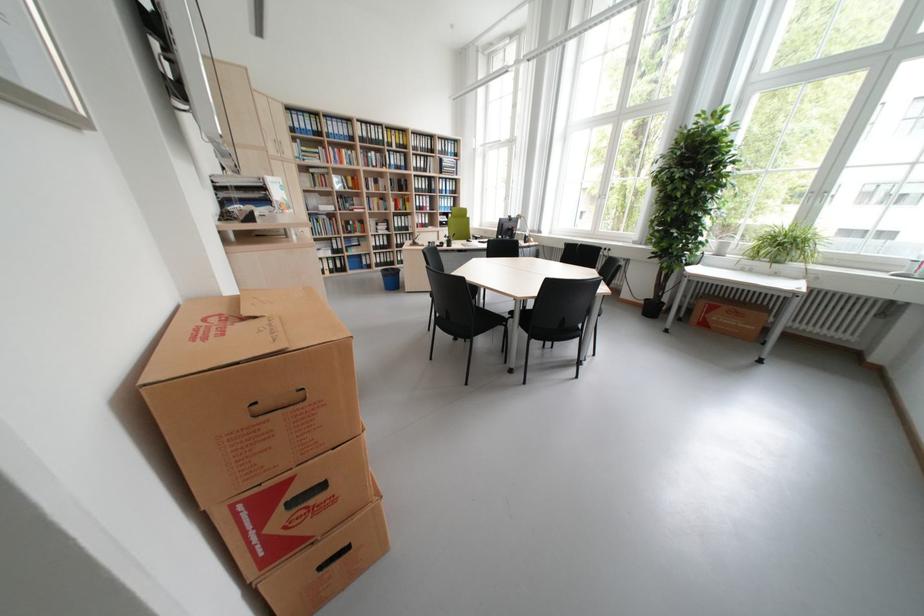
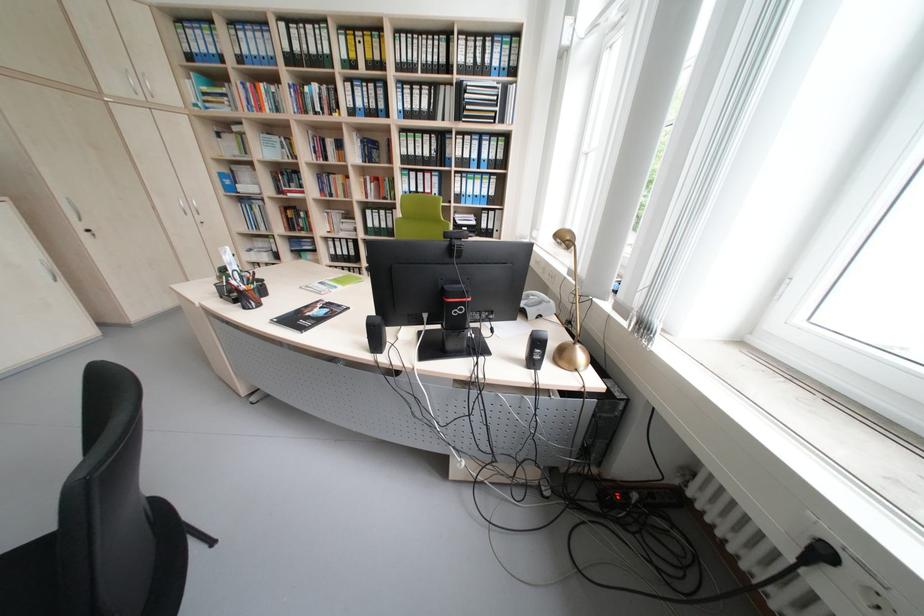
Find the pixel in the second image that matches point (322, 217) in the first image.

(253, 201)